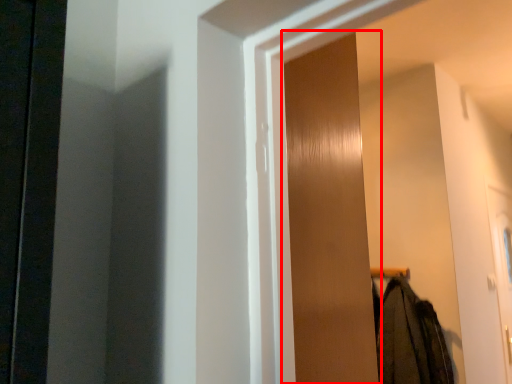
Question: In this image, where is screen door (annotated by the red box) located relative to clothing?

Choices:
 (A) left
 (B) right

Answer: (A)